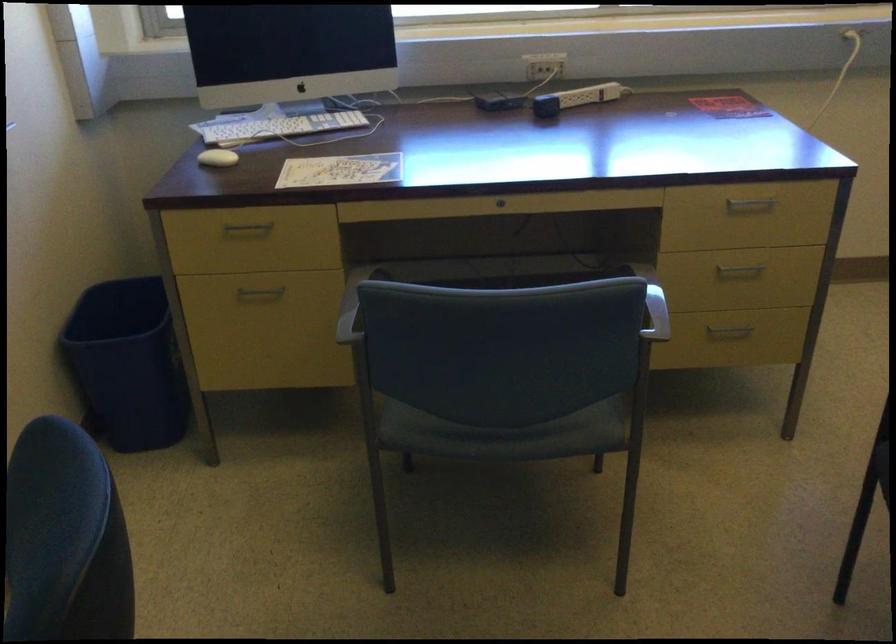
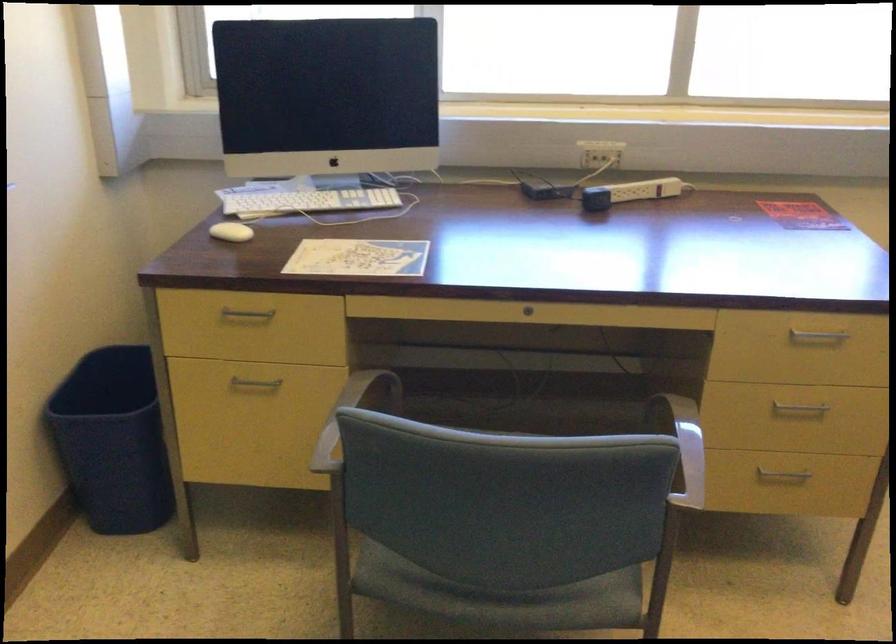
Where in the second image is the point corresponding to point 259,292 from the first image?

(254, 384)